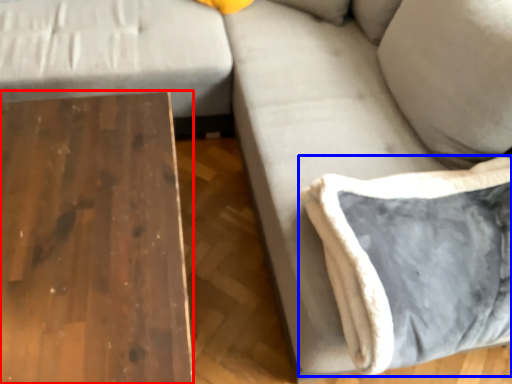
Question: Which object appears closest to the camera in this image, table (highlighted by a red box) or pillow (highlighted by a blue box)?

Choices:
 (A) table
 (B) pillow

Answer: (A)